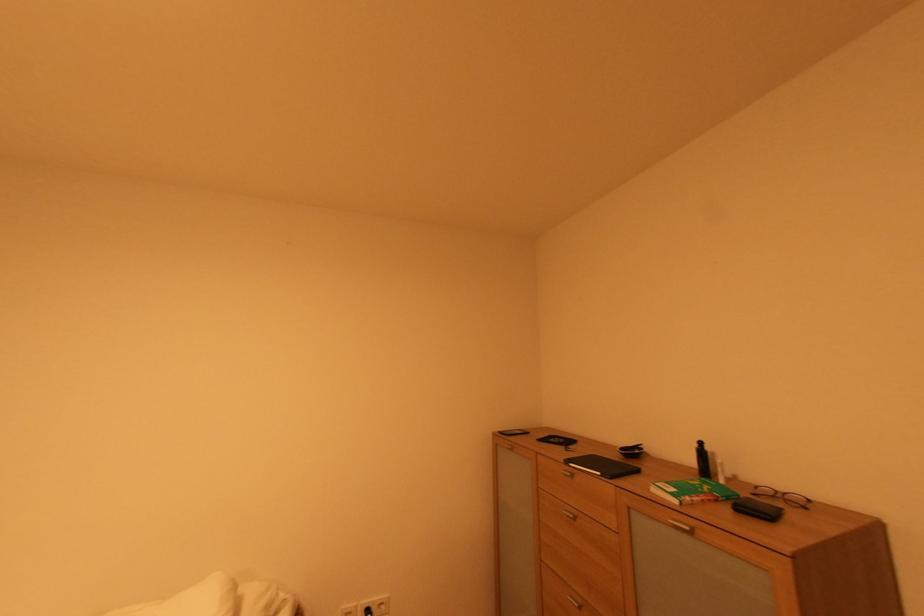
Locate an element on the screen. The width and height of the screenshot is (924, 616). white pillow is located at coordinates (190, 600).